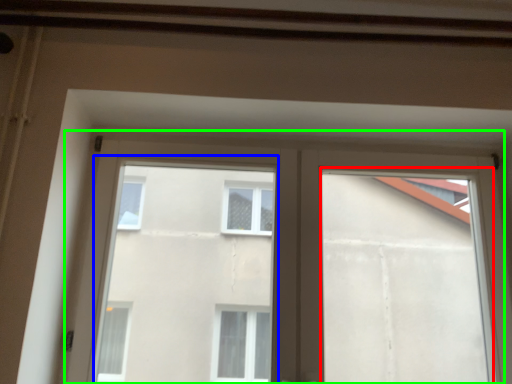
Question: Which object is the closest to the window frame (highlighted by a red box)? Choose among these: bay window (highlighted by a blue box) or window (highlighted by a green box).

Choices:
 (A) bay window
 (B) window

Answer: (B)